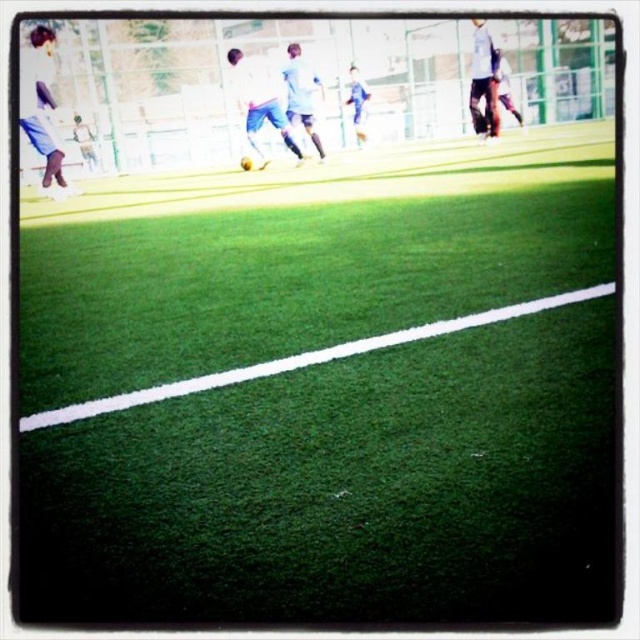
The image size is (640, 640). What do you see at coordinates (40, 102) in the screenshot? I see `light blue fabric pants at left` at bounding box center [40, 102].

Is light blue fabric pants at left to the right of white matte soccer player at center from the viewer's perspective?

In fact, light blue fabric pants at left is to the left of white matte soccer player at center.

Where is `light blue fabric pants at left`? Image resolution: width=640 pixels, height=640 pixels. light blue fabric pants at left is located at coordinates (40, 102).

This screenshot has width=640, height=640. I want to click on light blue fabric pants at left, so click(40, 102).

Between green artificial turf at center and light blue jersey at center, which one is positioned higher?

light blue jersey at center

Based on the photo, who is more distant from viewer, (593, 460) or (282, 116)?

The point (282, 116) is behind.

You are a GUI agent. You are given a task and a screenshot of the screen. Output one action in this format:
    pyautogui.click(x=<x>, y=<y>)
    Task: Click on the green artificial turf at center
    The height and width of the screenshot is (640, 640).
    Given the screenshot: What is the action you would take?
    pyautogui.click(x=323, y=387)

Is point (160, 246) positioned behind point (488, 72)?

No.

Where is `green artificial turf at center`? This screenshot has height=640, width=640. green artificial turf at center is located at coordinates (323, 387).